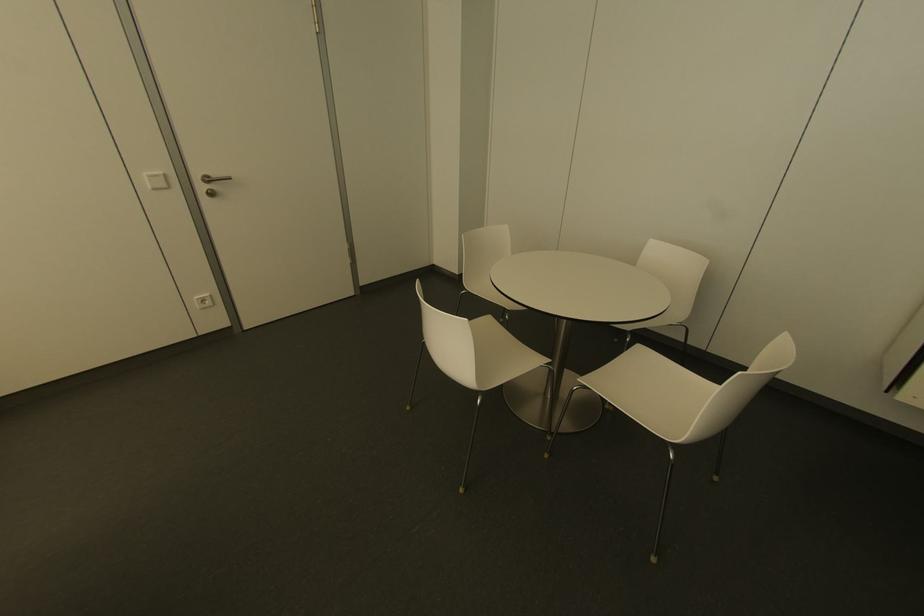
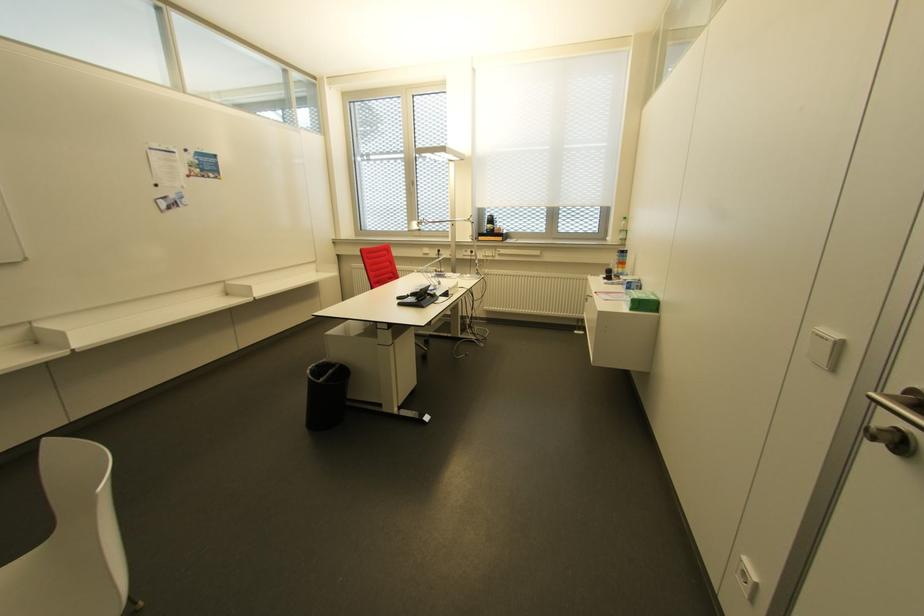
Locate, in the second image, the point that corresponds to pixel 159 172 in the first image.

(833, 334)